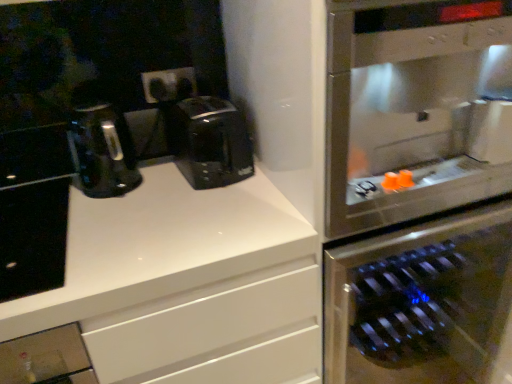
Identify the location of empty space that is ontop of white glossy countertop at upper left (from a real-world perspective). Image resolution: width=512 pixels, height=384 pixels. (108, 215).